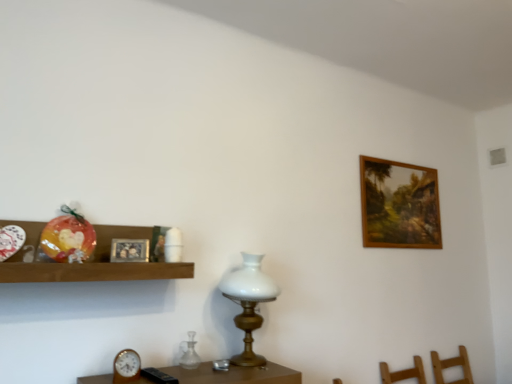
Identify the location of wooden clock at lower left. (126, 366).

Locate an element on the screen. wooden framed painting at upper right, positioned as the second picture frame in front-to-back order is located at coordinates (399, 205).

Measure the distance between point (232,278) and camera.

Point (232,278) and camera are 5.91 feet apart.

Identify the location of wooden clock at lower left. (126, 366).

Which is behind, point (35, 236) or point (197, 355)?

The point (197, 355) is more distant.

Could transparent glass vase at center be considered to be inside wooden shelf at left?

No, transparent glass vase at center is not inside wooden shelf at left.

Is wooden shelf at left aimed at transparent glass vase at center?

No, wooden shelf at left is not facing towards transparent glass vase at center.

Considering the sizes of objects wooden shelf at left and transparent glass vase at center in the image provided, who is taller, wooden shelf at left or transparent glass vase at center?

Standing taller between the two is wooden shelf at left.

Is wooden shelf at left touching silver metallic picture frame at upper left, acting as the first picture frame starting from the left?

No.

Is silver metallic picture frame at upper left, the second picture frame from the back, at the back of wooden shelf at left?

Absolutely, wooden shelf at left is directed away from silver metallic picture frame at upper left, the second picture frame from the back.

Is point (87, 265) positioned after point (111, 259)?

No, (87, 265) is closer to viewer.

Would you say wooden shelf at left contains silver metallic picture frame at upper left, acting as the first picture frame starting from the left?

Yes, wooden shelf at left is surrounding silver metallic picture frame at upper left, acting as the first picture frame starting from the left.

Locate an element on the screen. The width and height of the screenshot is (512, 384). candle holder that is behind the silver metallic picture frame at upper left, the second picture frame from the back is located at coordinates (189, 353).

From the image's perspective, does silver metallic picture frame at upper left, the second picture frame from the back, appear lower than transparent glass vase at center?

Actually, silver metallic picture frame at upper left, the second picture frame from the back, appears above transparent glass vase at center in the image.

Which of these two, silver metallic picture frame at upper left, placed as the 1th picture frame when sorted from front to back, or transparent glass vase at center, is smaller?

Smaller between the two is silver metallic picture frame at upper left, placed as the 1th picture frame when sorted from front to back.

Does point (117, 243) appear closer or farther from the camera than point (385, 247)?

Clearly, point (117, 243) is closer to the camera than point (385, 247).

In the scene shown: From a real-world perspective, is silver metallic picture frame at upper left, acting as the first picture frame starting from the left, on wooden framed painting at upper right, the 1th picture frame viewed from the right?

No, from a real-world perspective, silver metallic picture frame at upper left, acting as the first picture frame starting from the left, is not above wooden framed painting at upper right, the 1th picture frame viewed from the right.

Considering the sizes of objects silver metallic picture frame at upper left, the second picture frame from the back, and wooden framed painting at upper right, which is the first picture frame in back-to-front order, in the image provided, who is shorter, silver metallic picture frame at upper left, the second picture frame from the back, or wooden framed painting at upper right, which is the first picture frame in back-to-front order,?

With less height is silver metallic picture frame at upper left, the second picture frame from the back.

Does silver metallic picture frame at upper left, the second picture frame viewed from the right, appear on the left side of wooden framed painting at upper right, which is the first picture frame in back-to-front order?

Yes, silver metallic picture frame at upper left, the second picture frame viewed from the right, is to the left of wooden framed painting at upper right, which is the first picture frame in back-to-front order.

Can you tell me how much wooden clock at lower left and white glass table lamp at center differ in facing direction?

The facing directions of wooden clock at lower left and white glass table lamp at center are 6.73 degrees apart.

Is wooden clock at lower left shorter than white glass table lamp at center?

Correct, wooden clock at lower left is not as tall as white glass table lamp at center.

Does wooden clock at lower left have a smaller size compared to white glass table lamp at center?

Yes, wooden clock at lower left is smaller than white glass table lamp at center.

Is white glass table lamp at center at the back of wooden clock at lower left?

That's not correct — wooden clock at lower left is not looking away from white glass table lamp at center.

Between point (242, 360) and point (437, 237), which one is positioned in front?

The point (242, 360) is more forward.

In the scene shown: Can you tell me how much white glass table lamp at center and wooden framed painting at upper right, which is the first picture frame in back-to-front order, differ in facing direction?

0.662 degrees separate the facing orientations of white glass table lamp at center and wooden framed painting at upper right, which is the first picture frame in back-to-front order.

From the picture: Is white glass table lamp at center positioned behind wooden framed painting at upper right, positioned as the second picture frame in front-to-back order?

That is False.

From a real-world perspective, is white glass table lamp at center above or below wooden framed painting at upper right, positioned as the second picture frame in front-to-back order?

From a real-world perspective, white glass table lamp at center is physically below wooden framed painting at upper right, positioned as the second picture frame in front-to-back order.

From the image's perspective, which one is positioned lower, wooden clock at lower left or transparent glass vase at center?

From the image's view, transparent glass vase at center is below.

Is wooden clock at lower left aimed at transparent glass vase at center?

No, wooden clock at lower left is not aimed at transparent glass vase at center.

Which is in front, wooden clock at lower left or transparent glass vase at center?

Positioned in front is wooden clock at lower left.

The width and height of the screenshot is (512, 384). Identify the location of candle holder on the right of wooden shelf at left. (189, 353).

Locate an element on the screen. The height and width of the screenshot is (384, 512). shelf on the left of the silver metallic picture frame at upper left, placed as the 1th picture frame when sorted from front to back is located at coordinates (95, 263).

Based on their spatial positions, is white glass table lamp at center or silver metallic picture frame at upper left, the second picture frame from the back, closer to wooden clock at lower left?

silver metallic picture frame at upper left, the second picture frame from the back, is positioned closer to the anchor wooden clock at lower left.

Which object lies nearer to the anchor point wooden framed painting at upper right, the 1th picture frame viewed from the right, transparent glass vase at center or wooden shelf at left?

The object closer to wooden framed painting at upper right, the 1th picture frame viewed from the right, is transparent glass vase at center.

Considering their positions, is wooden shelf at left positioned further to white glass table lamp at center than wooden clock at lower left?

wooden clock at lower left lies further to white glass table lamp at center than the other object.

Consider the image. When comparing their distances from wooden framed painting at upper right, which is the first picture frame in back-to-front order, does wooden shelf at left or white glass table lamp at center seem closer?

white glass table lamp at center is positioned closer to the anchor wooden framed painting at upper right, which is the first picture frame in back-to-front order.

Consider the image. When comparing their distances from white glass table lamp at center, does transparent glass vase at center or wooden framed painting at upper right, positioned as the second picture frame in front-to-back order, seem further?

Among the two, wooden framed painting at upper right, positioned as the second picture frame in front-to-back order, is located further to white glass table lamp at center.

Which object lies further to the anchor point wooden shelf at left, white glass table lamp at center or wooden clock at lower left?

white glass table lamp at center lies further to wooden shelf at left than the other object.

Considering their positions, is wooden clock at lower left positioned closer to white glass table lamp at center than wooden framed painting at upper right, positioned as the second picture frame in front-to-back order?

Among the two, wooden clock at lower left is located nearer to white glass table lamp at center.

Which object lies further to the anchor point silver metallic picture frame at upper left, placed as the 1th picture frame when sorted from front to back, wooden framed painting at upper right, the second picture frame in the left-to-right sequence, or wooden shelf at left?

Among the two, wooden framed painting at upper right, the second picture frame in the left-to-right sequence, is located further to silver metallic picture frame at upper left, placed as the 1th picture frame when sorted from front to back.

Where is `table lamp located between silver metallic picture frame at upper left, the second picture frame from the back, and wooden framed painting at upper right, the second picture frame in the left-to-right sequence, in the left-right direction`? The image size is (512, 384). table lamp located between silver metallic picture frame at upper left, the second picture frame from the back, and wooden framed painting at upper right, the second picture frame in the left-to-right sequence, in the left-right direction is located at coordinates (248, 303).

Locate an element on the screen. This screenshot has height=384, width=512. candle holder situated between wooden clock at lower left and white glass table lamp at center from left to right is located at coordinates (189, 353).

This screenshot has width=512, height=384. What are the coordinates of `clock that lies between wooden shelf at left and transparent glass vase at center from top to bottom` in the screenshot? It's located at (126, 366).

Where is `picture frame between wooden shelf at left and wooden clock at lower left in the vertical direction`? picture frame between wooden shelf at left and wooden clock at lower left in the vertical direction is located at coordinates (129, 250).